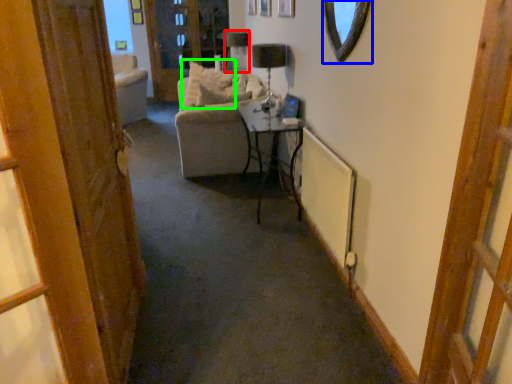
Question: Which object is the farthest from lamp (highlighted by a red box)? Choose among these: mirror (highlighted by a blue box) or pillow (highlighted by a green box).

Choices:
 (A) mirror
 (B) pillow

Answer: (A)